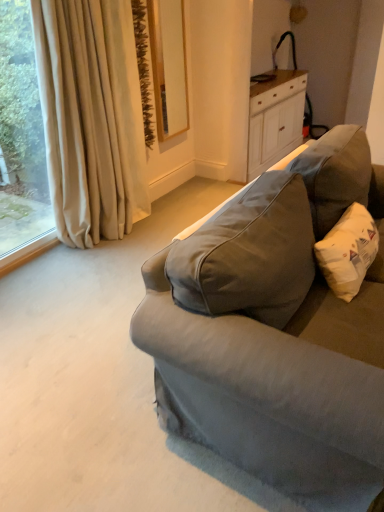
Locate an element on the screen. free region on the left part of matte gray fabric couch at right is located at coordinates (80, 349).